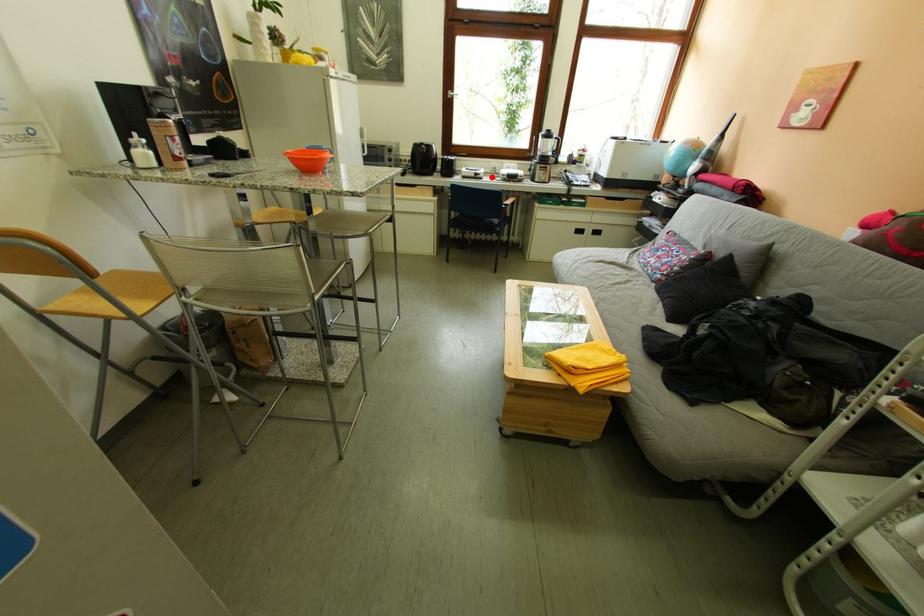
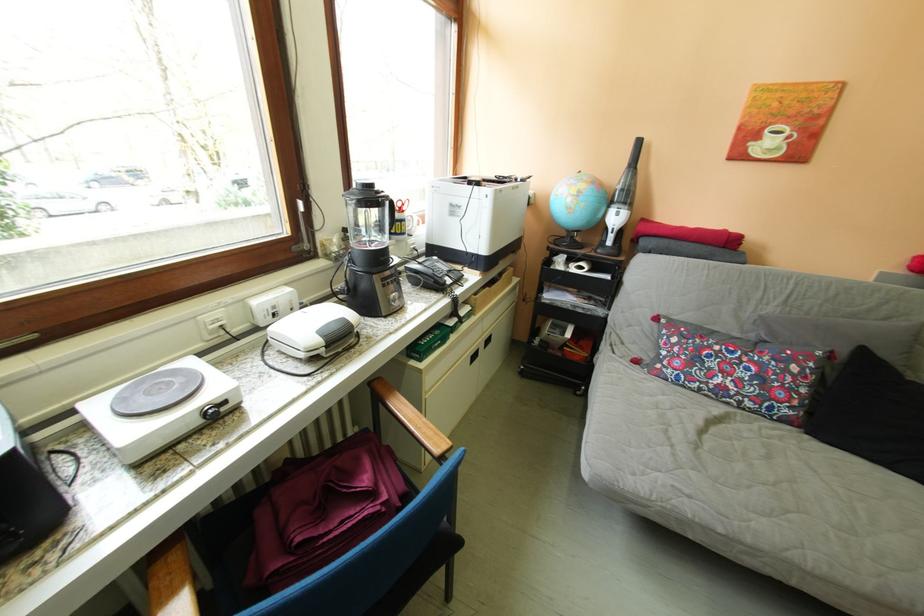
In the second image, find the point that corresponds to the highlighted location in the first image.

(237, 406)